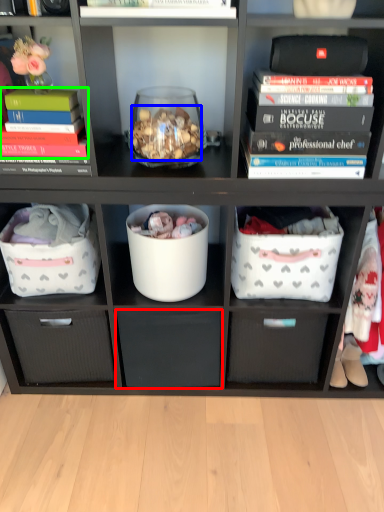
Question: Which object is the farthest from drawer (highlighted by a red box)? Choose among these: stuff (highlighted by a blue box) or book (highlighted by a green box).

Choices:
 (A) stuff
 (B) book

Answer: (B)